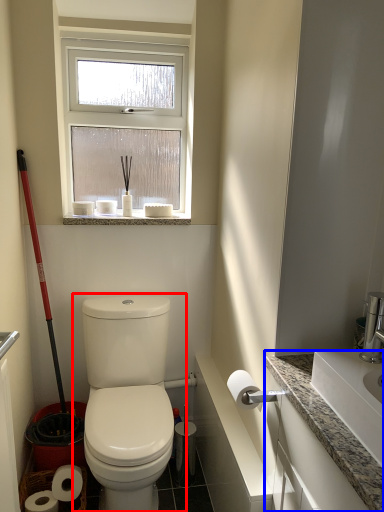
Question: Which of the following is the farthest to the observer, toilet (highlighted by a red box) or counter top (highlighted by a blue box)?

Choices:
 (A) toilet
 (B) counter top

Answer: (A)